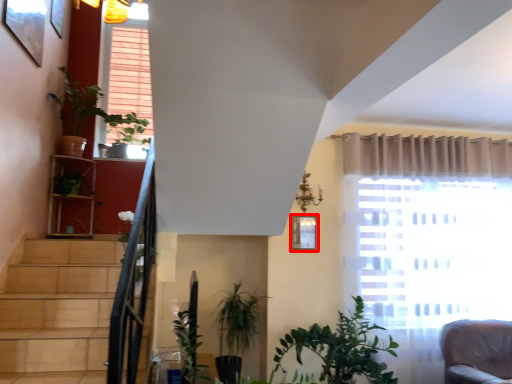
Question: From the image's perspective, where is picture frame (annotated by the red box) located in relation to plant in the image?

Choices:
 (A) below
 (B) above

Answer: (A)